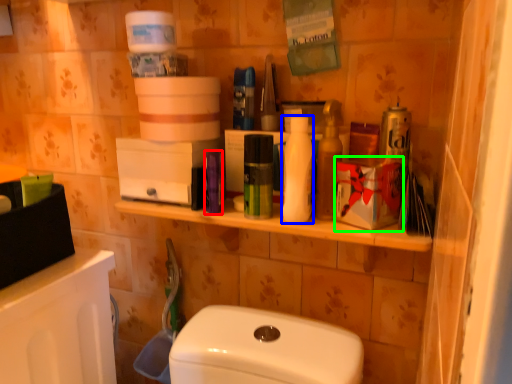
Question: Based on their relative distances, which object is nearer to toiletry (highlighted by a red box)? Choose from toiletry (highlighted by a blue box) and box (highlighted by a green box).

Choices:
 (A) toiletry
 (B) box

Answer: (A)